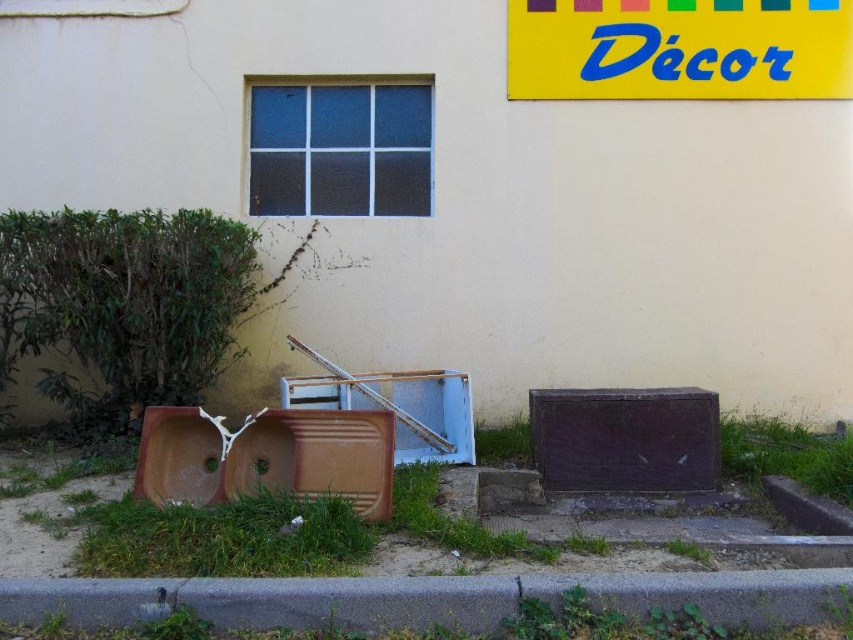
Question: Does gray asphalt curb at lower center have a lesser width compared to brown matte sink at lower left?

Choices:
 (A) no
 (B) yes

Answer: (A)

Question: Which object is closer to the camera taking this photo?

Choices:
 (A) gray asphalt curb at lower center
 (B) yellow plastic sign at upper center

Answer: (A)

Question: Does yellow plastic sign at upper center have a lesser width compared to brown matte sink at lower left?

Choices:
 (A) yes
 (B) no

Answer: (B)

Question: Estimate the real-world distances between objects in this image. Which object is closer to the gray asphalt curb at lower center?

Choices:
 (A) yellow plastic sign at upper center
 (B) brown matte sink at lower left

Answer: (B)

Question: Does gray asphalt curb at lower center have a smaller size compared to yellow plastic sign at upper center?

Choices:
 (A) yes
 (B) no

Answer: (A)

Question: Which object is positioned closest to the yellow plastic sign at upper center?

Choices:
 (A) gray asphalt curb at lower center
 (B) brown matte sink at lower left

Answer: (B)